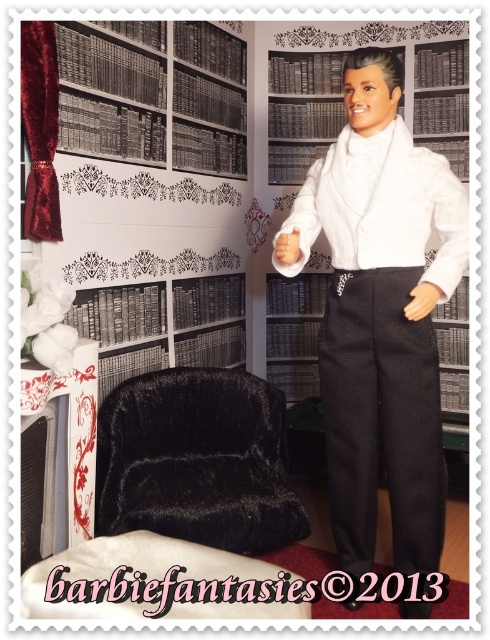
You are standing in the library and need to locate the white satin tuxedo at center. According to the coordinates provided, where exactly is it positioned in the room?

The white satin tuxedo at center is located at the coordinates point (381, 314).

You are organizing a formal event and need to place the white satin tuxedo at center on top of the velvet black armchair at lower left. Considering their sizes, will the tuxedo fit properly on the armchair?

The white satin tuxedo at center has a lesser width compared to the velvet black armchair at lower left, so it will fit properly on the armchair since it is narrower than the chair.